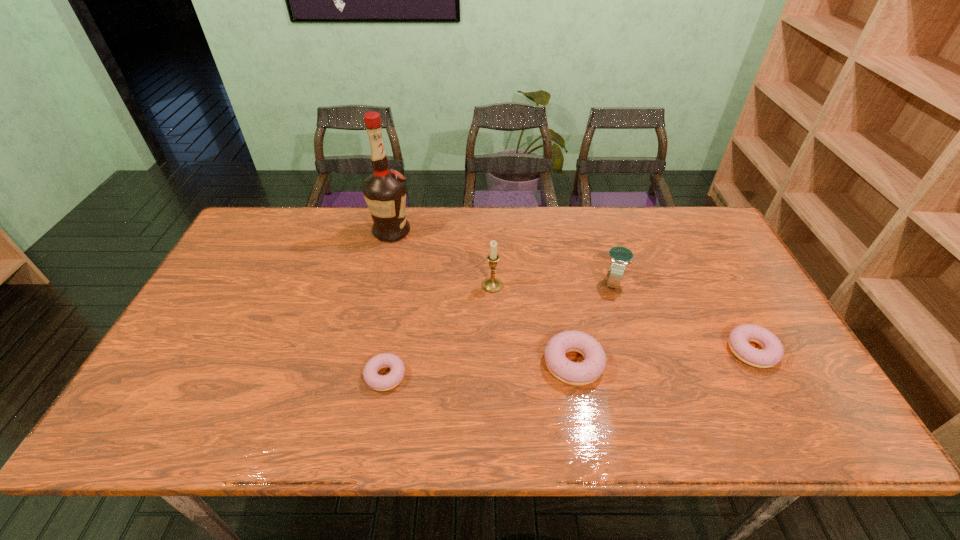
The height and width of the screenshot is (540, 960). I want to click on free space between the second doughnut from right to left and the second tallest doughnut, so click(662, 357).

Identify the location of free space between the farthest object and the third object from left to right. (442, 259).

This screenshot has height=540, width=960. What are the coordinates of `vacant area that lies between the third shortest object and the rightmost doughnut` in the screenshot? It's located at (662, 357).

At what (x,y) coordinates should I click in order to perform the action: click on free point between the shortest object and the candle holder. Please return your answer as a coordinate pair (x, y). This screenshot has width=960, height=540. Looking at the image, I should click on (439, 330).

Locate an element on the screen. This screenshot has width=960, height=540. blank region between the second object from right to left and the liquor is located at coordinates (503, 256).

Find the location of a particular element. The image size is (960, 540). vacant space that is in between the shortest object and the second doughnut from left to right is located at coordinates (479, 369).

This screenshot has height=540, width=960. In order to click on free space between the rightmost doughnut and the tallest doughnut in this screenshot , I will do `click(662, 357)`.

Locate an element on the screen. The image size is (960, 540). free spot between the second tallest object and the tallest doughnut is located at coordinates (533, 325).

Locate which object is the closest to the second doughnut from left to right. Please provide its 2D coordinates. Your answer should be formatted as a tuple, i.e. [(x, y)], where the tuple contains the x and y coordinates of a point satisfying the conditions above.

[(620, 257)]

This screenshot has width=960, height=540. Find the location of `object that is the nearest to the tallest object`. object that is the nearest to the tallest object is located at coordinates (492, 285).